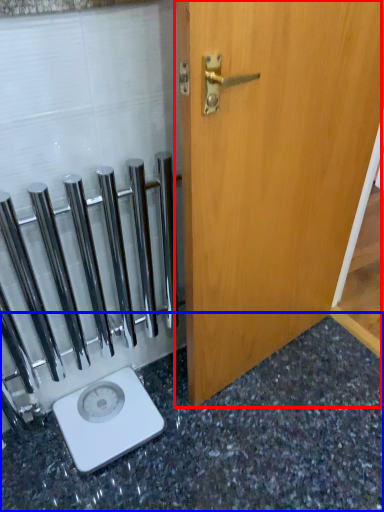
Question: Which point is closer to the camera, door (highlighted by a red box) or granite (highlighted by a blue box)?

Choices:
 (A) door
 (B) granite

Answer: (A)